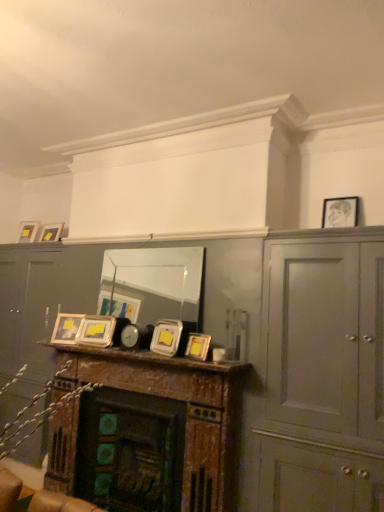
The width and height of the screenshot is (384, 512). What are the coordinates of `metallic silver picture frame at center, which appears as the third picture frame when viewed from the back` in the screenshot? It's located at (96, 331).

Image resolution: width=384 pixels, height=512 pixels. What do you see at coordinates (130, 337) in the screenshot?
I see `metallic silver clock at center` at bounding box center [130, 337].

Where is `matte gold picture frame at center, the first picture frame ordered from the bottom`? matte gold picture frame at center, the first picture frame ordered from the bottom is located at coordinates (198, 346).

How much space does matte gold picture frame at upper left, arranged as the sixth picture frame when viewed from the front, occupy vertically?

It is 8.03 inches.

The width and height of the screenshot is (384, 512). What do you see at coordinates (166, 337) in the screenshot?
I see `metallic silver picture frame at center, positioned as the third picture frame in right-to-left order` at bounding box center [166, 337].

Find the location of `metallic silver picture frame at center, the 3th picture frame from the bottom`. metallic silver picture frame at center, the 3th picture frame from the bottom is located at coordinates (96, 331).

Is matte silver picture frame at center, acting as the 5th picture frame starting from the right, beside clear glass mirror at center?

They are not placed beside each other.

Is matte silver picture frame at center, placed as the 5th picture frame when sorted from top to bottom, in front of or behind clear glass mirror at center in the image?

In the image, matte silver picture frame at center, placed as the 5th picture frame when sorted from top to bottom, appears behind clear glass mirror at center.

From the image's perspective, is matte silver picture frame at center, which ranks as the fifth picture frame in front-to-back order, above or below clear glass mirror at center?

matte silver picture frame at center, which ranks as the fifth picture frame in front-to-back order, is situated lower than clear glass mirror at center in the image.

Does point (76, 316) lie behind point (174, 285)?

Yes, point (76, 316) is farther from viewer.

Considering the sizes of objects clear glass mirror at center and wooden mantel at center in the image provided, who is taller, clear glass mirror at center or wooden mantel at center?

Standing taller between the two is wooden mantel at center.

From a real-world perspective, is clear glass mirror at center positioned over wooden mantel at center based on gravity?

Correct, in the physical world, clear glass mirror at center is higher than wooden mantel at center.

From the image's perspective, which object appears higher, clear glass mirror at center or wooden mantel at center?

clear glass mirror at center is shown above in the image.

Is clear glass mirror at center smaller than wooden mantel at center?

Yes.

In the scene shown: Which is more to the right, wooden mantel at center or matte silver picture frame at center, positioned as the 2th picture frame in bottom-to-top order?

wooden mantel at center is more to the right.

How different are the orientations of wooden mantel at center and matte silver picture frame at center, the 2th picture frame when ordered from back to front, in degrees?

wooden mantel at center and matte silver picture frame at center, the 2th picture frame when ordered from back to front, are facing 24 degrees away from each other.

Is wooden mantel at center oriented towards matte silver picture frame at center, positioned as the second picture frame in left-to-right order?

No, wooden mantel at center is not oriented towards matte silver picture frame at center, positioned as the second picture frame in left-to-right order.

Can you confirm if wooden mantel at center is wider than matte silver picture frame at center, which ranks as the fifth picture frame in front-to-back order?

Indeed, wooden mantel at center has a greater width compared to matte silver picture frame at center, which ranks as the fifth picture frame in front-to-back order.

Is matte black picture frame at upper right, which ranks as the third picture frame in front-to-back order, positioned in front of matte gold picture frame at upper left, the sixth picture frame in the right-to-left sequence?

Yes, matte black picture frame at upper right, which ranks as the third picture frame in front-to-back order, is closer to the viewer.

Is matte black picture frame at upper right, which is counted as the first picture frame, starting from the right, facing towards matte gold picture frame at upper left, the sixth picture frame in the right-to-left sequence?

No, matte black picture frame at upper right, which is counted as the first picture frame, starting from the right, is not oriented towards matte gold picture frame at upper left, the sixth picture frame in the right-to-left sequence.

Based on the photo, would you consider matte black picture frame at upper right, the 4th picture frame when ordered from back to front, to be distant from matte gold picture frame at upper left, which is the fifth picture frame from bottom to top?

Yes, matte black picture frame at upper right, the 4th picture frame when ordered from back to front, and matte gold picture frame at upper left, which is the fifth picture frame from bottom to top, are located far from each other.

Does point (190, 345) come in front of point (135, 348)?

That is True.

Between matte gold picture frame at center, acting as the 6th picture frame starting from the back, and metallic silver clock at center, which one is positioned behind?

Positioned behind is metallic silver clock at center.

Is metallic silver clock at center located within matte gold picture frame at center, acting as the 6th picture frame starting from the back?

No, metallic silver clock at center is not a part of matte gold picture frame at center, acting as the 6th picture frame starting from the back.

Would you say matte gold picture frame at center, the second picture frame in the right-to-left sequence, is to the left or to the right of metallic silver clock at center in the picture?

From the image, it's evident that matte gold picture frame at center, the second picture frame in the right-to-left sequence, is to the right of metallic silver clock at center.

Between matte gold picture frame at center, the 1th picture frame positioned from the front, and metallic silver picture frame at center, the 3th picture frame from the bottom, which one has smaller size?

matte gold picture frame at center, the 1th picture frame positioned from the front.

From the image's perspective, is matte gold picture frame at center, the 1th picture frame positioned from the front, above or below metallic silver picture frame at center, the 3th picture frame from the bottom?

matte gold picture frame at center, the 1th picture frame positioned from the front, is below metallic silver picture frame at center, the 3th picture frame from the bottom.

Does point (196, 337) appear closer or farther from the camera than point (85, 341)?

Point (196, 337) is positioned closer to the camera compared to point (85, 341).

Locate an element on the screen. The image size is (384, 512). the 2nd picture frame located above the matte gold picture frame at center, the 1th picture frame positioned from the front (from a real-world perspective) is located at coordinates pyautogui.click(x=96, y=331).

Is metallic silver picture frame at center, positioned as the third picture frame in right-to-left order, next to wooden mantel at center and touching it?

No, metallic silver picture frame at center, positioned as the third picture frame in right-to-left order, is not making contact with wooden mantel at center.

In the scene shown: How different are the orientations of metallic silver picture frame at center, which is the fourth picture frame in bottom-to-top order, and wooden mantel at center in degrees?

The angular difference between metallic silver picture frame at center, which is the fourth picture frame in bottom-to-top order, and wooden mantel at center is 18.6 degrees.

Is metallic silver picture frame at center, which is the fourth picture frame in bottom-to-top order, oriented towards wooden mantel at center?

No, metallic silver picture frame at center, which is the fourth picture frame in bottom-to-top order, does not turn towards wooden mantel at center.

From a real-world perspective, between metallic silver picture frame at center, arranged as the fifth picture frame when viewed from the back, and wooden mantel at center, who is vertically higher?

From a 3D spatial view, metallic silver picture frame at center, arranged as the fifth picture frame when viewed from the back, is above.

Which picture frame is the 2nd one when counting from the left side of the clear glass mirror at center? Please provide its 2D coordinates.

[(66, 328)]

Find the location of a particular element. table below the clear glass mirror at center (from a real-world perspective) is located at coordinates (146, 431).

Looking at the image, which one is located closer to matte gold picture frame at upper left, the first picture frame from the back, wooden mantel at center or metallic silver picture frame at center, positioned as the third picture frame in right-to-left order?

The object closer to matte gold picture frame at upper left, the first picture frame from the back, is metallic silver picture frame at center, positioned as the third picture frame in right-to-left order.

When comparing their distances from matte gold picture frame at upper left, placed as the 1th picture frame when sorted from left to right, does metallic silver clock at center or wooden mantel at center seem closer?

Based on the image, metallic silver clock at center appears to be nearer to matte gold picture frame at upper left, placed as the 1th picture frame when sorted from left to right.

Based on their spatial positions, is matte silver picture frame at center, positioned as the second picture frame in left-to-right order, or matte gold picture frame at upper left, the sixth picture frame in the right-to-left sequence, closer to metallic silver picture frame at center, which is the fourth picture frame in bottom-to-top order?

matte silver picture frame at center, positioned as the second picture frame in left-to-right order, is closer to metallic silver picture frame at center, which is the fourth picture frame in bottom-to-top order.

From the image, which object appears to be nearer to metallic silver frames at center, wooden mantel at center or matte black picture frame at upper right, the 4th picture frame when ordered from back to front?

The object closer to metallic silver frames at center is wooden mantel at center.

Estimate the real-world distances between objects in this image. Which object is closer to metallic silver picture frame at center, the third picture frame when ordered from top to bottom, matte silver picture frame at center, acting as the 5th picture frame starting from the right, or metallic silver picture frame at center, marked as the fourth picture frame in a right-to-left arrangement?

metallic silver picture frame at center, marked as the fourth picture frame in a right-to-left arrangement, is closer to metallic silver picture frame at center, the third picture frame when ordered from top to bottom.

When comparing their distances from matte silver picture frame at center, placed as the 5th picture frame when sorted from top to bottom, does matte gold picture frame at center, the first picture frame ordered from the bottom, or matte gray cabinet at right seem further?

Based on the image, matte gray cabinet at right appears to be further to matte silver picture frame at center, placed as the 5th picture frame when sorted from top to bottom.

Considering their positions, is matte gold picture frame at upper left, which is the fifth picture frame from bottom to top, positioned closer to metallic silver picture frame at center, which appears as the third picture frame when viewed from the back, than matte gray cabinet at right?

matte gold picture frame at upper left, which is the fifth picture frame from bottom to top, is closer to metallic silver picture frame at center, which appears as the third picture frame when viewed from the back.

Looking at this image, from the image, which object appears to be nearer to metallic silver picture frame at center, which is the fourth picture frame in bottom-to-top order, matte gold picture frame at center, the 1th picture frame positioned from the front, or matte black picture frame at upper right, arranged as the 6th picture frame when viewed from the left?

Among the two, matte gold picture frame at center, the 1th picture frame positioned from the front, is located nearer to metallic silver picture frame at center, which is the fourth picture frame in bottom-to-top order.

The image size is (384, 512). In order to click on dresser between metallic silver frames at center and matte black picture frame at upper right, placed as the 1th picture frame when sorted from top to bottom in this screenshot , I will do `click(320, 376)`.

Locate an element on the screen. mirror situated between metallic silver picture frame at center, marked as the fourth picture frame in a right-to-left arrangement, and matte black picture frame at upper right, arranged as the sixth picture frame when ordered from the bottom, from left to right is located at coordinates (156, 282).

You are a GUI agent. You are given a task and a screenshot of the screen. Output one action in this format:
    pyautogui.click(x=<x>, y=<y>)
    Task: Click on the mantle that lies between metallic silver picture frame at center, marked as the fourth picture frame in a right-to-left arrangement, and wooden mantel at center from top to bottom
    Image resolution: width=384 pixels, height=512 pixels.
    Given the screenshot: What is the action you would take?
    pyautogui.click(x=148, y=359)

This screenshot has width=384, height=512. I want to click on clock located between matte silver picture frame at center, placed as the 5th picture frame when sorted from top to bottom, and clear glass mirror at center in the left-right direction, so click(130, 337).